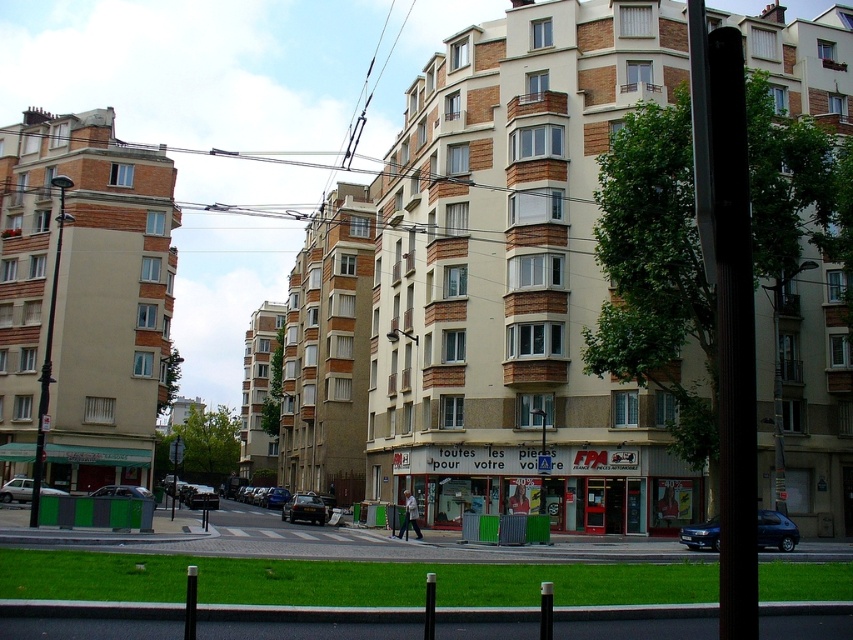
Question: Does dark blue metallic car at lower right appear on the left side of shiny black car at lower center?

Choices:
 (A) no
 (B) yes

Answer: (A)

Question: Estimate the real-world distances between objects in this image. Which object is farther from the white matte car at lower left?

Choices:
 (A) shiny black car at lower center
 (B) dark blue metallic car at lower right

Answer: (B)

Question: Based on their relative distances, which object is nearer to the white matte car at lower left?

Choices:
 (A) dark blue metallic car at lower right
 (B) metallic silver car at lower left
 (C) shiny black car at lower center

Answer: (B)

Question: Is dark blue metallic car at lower right positioned before white matte car at lower left?

Choices:
 (A) yes
 (B) no

Answer: (A)

Question: Is dark blue metallic car at lower right bigger than white matte car at lower left?

Choices:
 (A) yes
 (B) no

Answer: (A)

Question: Estimate the real-world distances between objects in this image. Which object is closer to the metallic silver car at lower left?

Choices:
 (A) dark blue metallic car at lower right
 (B) shiny black car at lower center

Answer: (B)